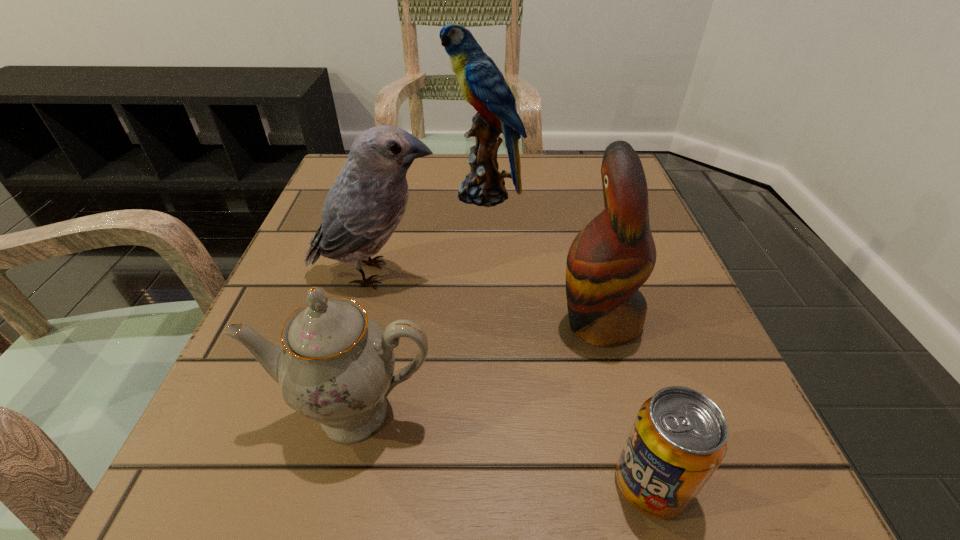
In order to click on vacant space that satisfies the following two spatial constraints: 1. on the face of the farthest parrot; 2. on the back side of the shortest object in this screenshot , I will do `click(488, 483)`.

Find the location of a particular element. The image size is (960, 540). vacant space that satisfies the following two spatial constraints: 1. on the face of the farthest object; 2. on the spout of the chinaware is located at coordinates pyautogui.click(x=487, y=413).

Where is `free space that satisfies the following two spatial constraints: 1. on the front-facing side of the fourth nearest object; 2. on the right side of the shortest object`? free space that satisfies the following two spatial constraints: 1. on the front-facing side of the fourth nearest object; 2. on the right side of the shortest object is located at coordinates (321, 483).